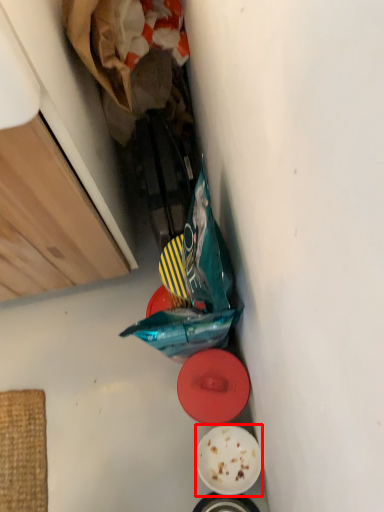
Question: From the image's perspective, what is the correct spatial positioning of plate (annotated by the red box) in reference to plate?

Choices:
 (A) below
 (B) above

Answer: (A)